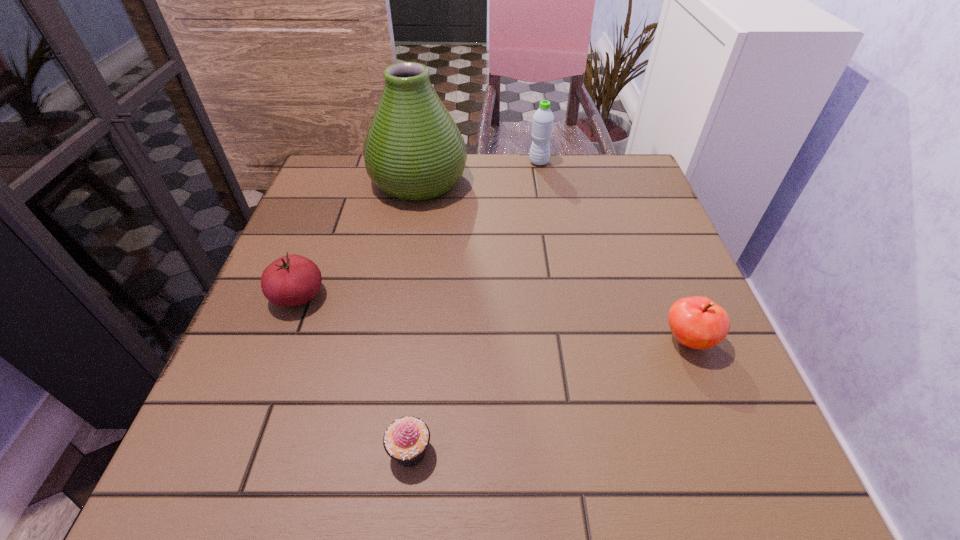
Where is `vase`? vase is located at coordinates (413, 150).

Where is `the fourth object from left to right`? The height and width of the screenshot is (540, 960). the fourth object from left to right is located at coordinates (543, 119).

This screenshot has width=960, height=540. In order to click on the fourth shortest object in this screenshot , I will do `click(543, 119)`.

You are a GUI agent. You are given a task and a screenshot of the screen. Output one action in this format:
    pyautogui.click(x=<x>, y=<y>)
    Task: Click on the second nearest object
    The height and width of the screenshot is (540, 960).
    Given the screenshot: What is the action you would take?
    pyautogui.click(x=697, y=322)

This screenshot has width=960, height=540. Identify the location of apple. (697, 322).

Where is `the third nearest object`? the third nearest object is located at coordinates (291, 280).

Where is `the leftmost object`? This screenshot has width=960, height=540. the leftmost object is located at coordinates (291, 280).

This screenshot has height=540, width=960. In order to click on cupcake in this screenshot , I will do `click(406, 439)`.

Image resolution: width=960 pixels, height=540 pixels. In order to click on the shortest object in this screenshot , I will do `click(406, 439)`.

In order to click on vacant region located 0.180m on the front of the tallest object in this screenshot , I will do `click(404, 265)`.